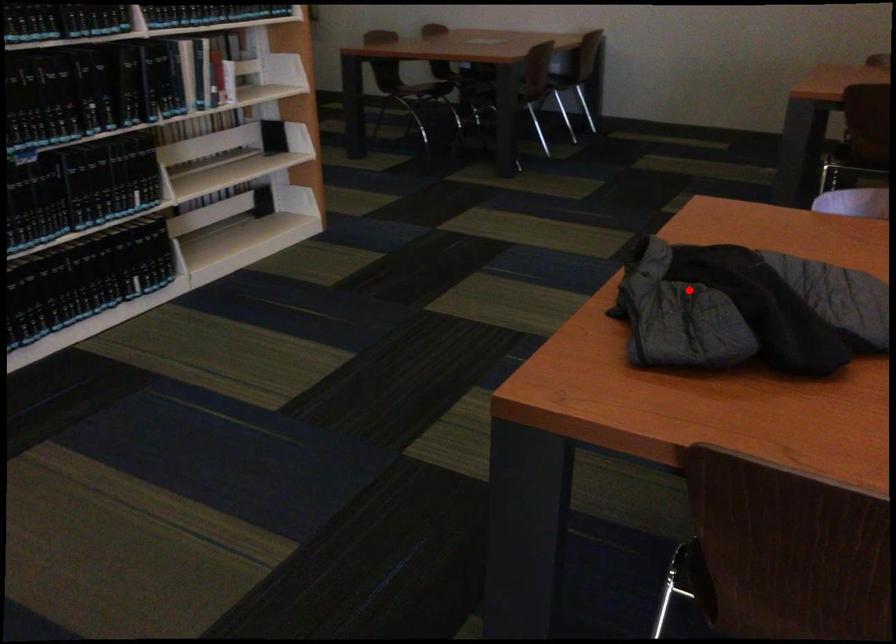
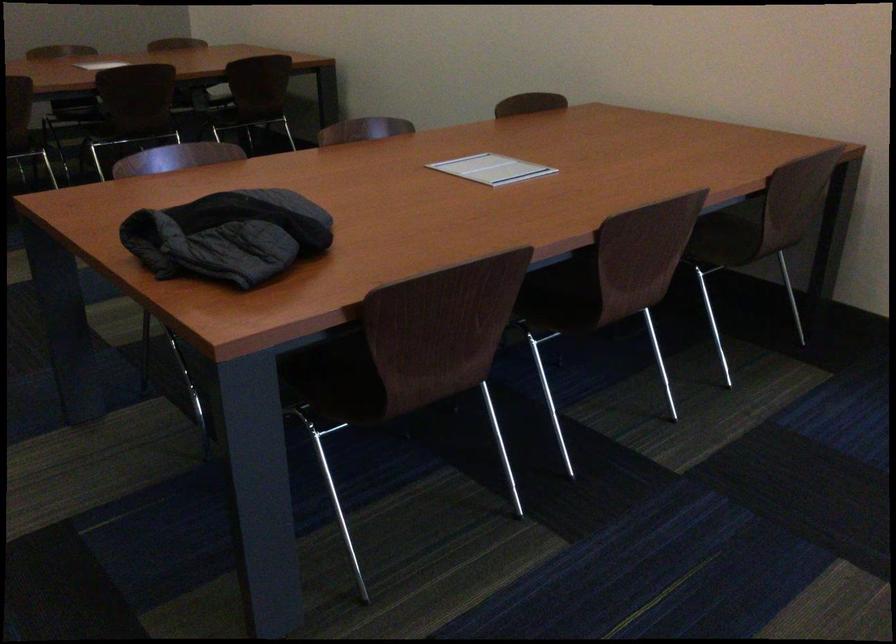
Question: I am providing you with two images of the same scene from different viewpoints. In image1, a red point is highlighted. Considering the same 3D point in image2, which of the following is correct?

Choices:
 (A) It is closer
 (B) It is farther

Answer: (B)